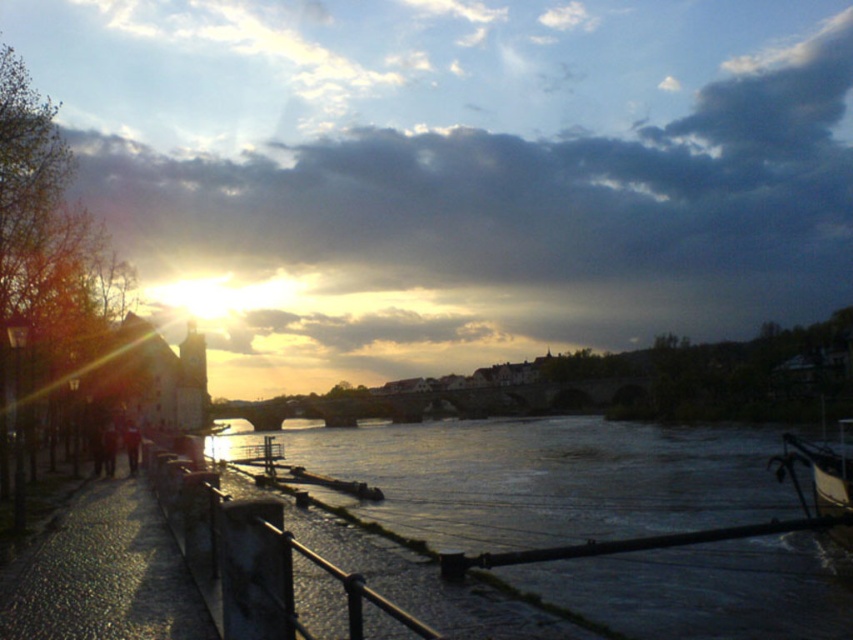
You are standing on the riverside walkway and see two points marked in the scene. Which point is closer to you, point (297, 445) or point (838, 509)?

Point (297, 445) is further to the viewer than point (838, 509), so point (838, 509) is closer to you.

You are a delivery person needing to cross the river using the walkway. The smooth concrete railing at lower left and metallic polished boat at lower right are both visible from your current position. How far apart are these two landmarks?

The smooth concrete railing at lower left is 18.51 meters from metallic polished boat at lower right, so the distance between them is 18.51 meters.